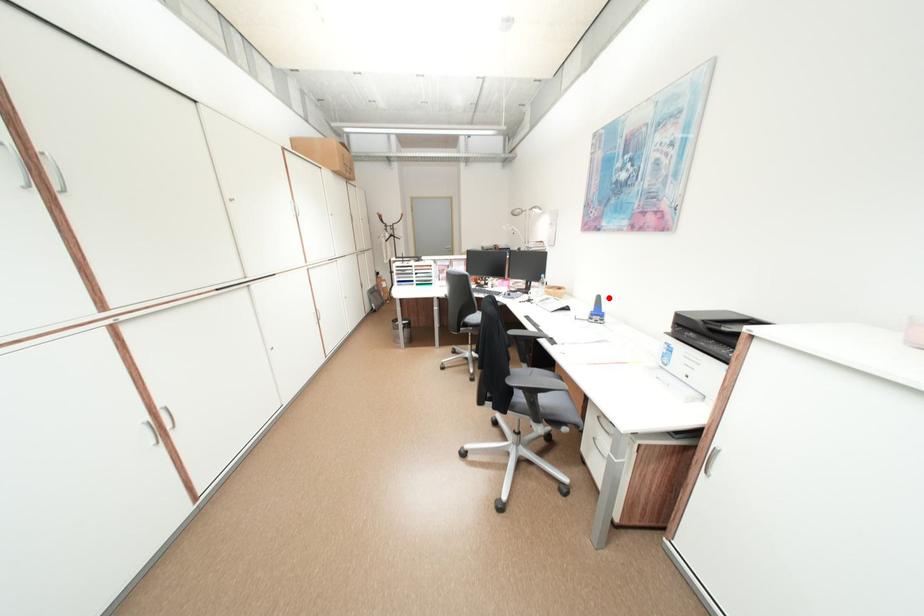
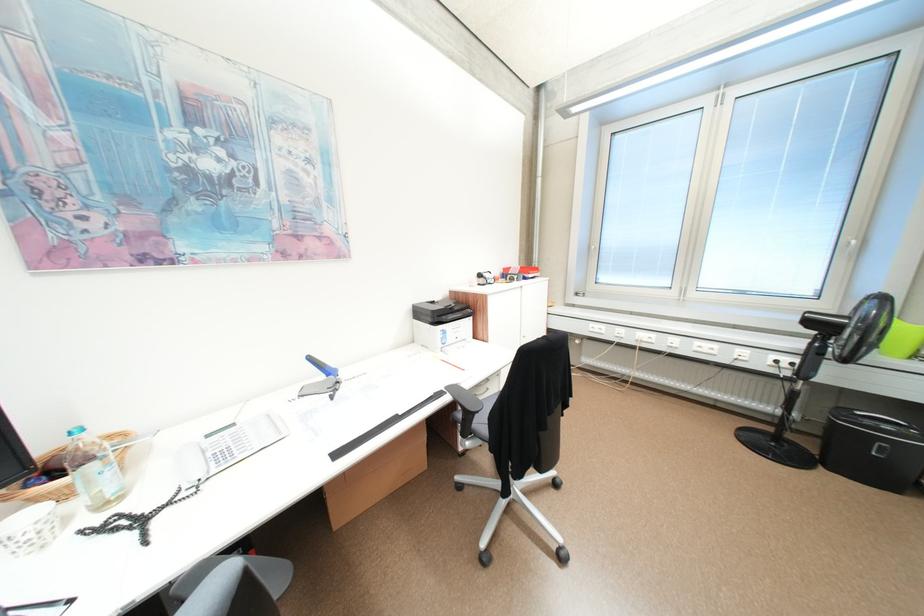
Question: A red point is marked in image1. In image2, is the corresponding 3D point closer to the camera or farther? Reply with the corresponding letter.

Choices:
 (A) The corresponding 3D point is closer.
 (B) The corresponding 3D point is farther.

Answer: (B)